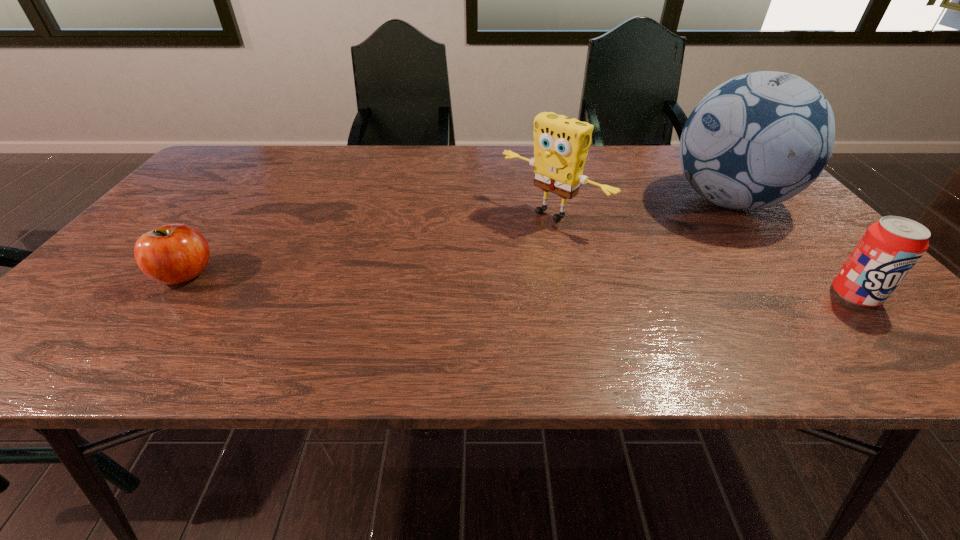
Image resolution: width=960 pixels, height=540 pixels. I want to click on object that is positioned at the far right corner, so click(x=758, y=139).

Where is `object at the near right corner`? This screenshot has width=960, height=540. object at the near right corner is located at coordinates (889, 249).

You are a GUI agent. You are given a task and a screenshot of the screen. Output one action in this format:
    pyautogui.click(x=<x>, y=<y>)
    Task: Click on the free spot at the far edge of the desktop
    
    Given the screenshot: What is the action you would take?
    pyautogui.click(x=355, y=171)

Find the location of a particular element. The image size is (960, 540). blank space at the near edge of the desktop is located at coordinates (333, 300).

Locate an element on the screen. The height and width of the screenshot is (540, 960). vacant space at the right edge is located at coordinates (800, 260).

Where is `vacant region at the far left corner of the desktop`? vacant region at the far left corner of the desktop is located at coordinates (229, 147).

Where is `vacant space at the near right corner of the desktop`? The image size is (960, 540). vacant space at the near right corner of the desktop is located at coordinates (821, 296).

You are a GUI agent. You are given a task and a screenshot of the screen. Output one action in this format:
    pyautogui.click(x=<x>, y=<y>)
    Task: Click on the vacant space that is in between the soccer ball and the third shortest object
    The width and height of the screenshot is (960, 540).
    Given the screenshot: What is the action you would take?
    pyautogui.click(x=640, y=207)

I want to click on unoccupied area between the sponge and the second shortest object, so click(x=704, y=254).

This screenshot has width=960, height=540. Identify the location of free space between the soccer ball and the sponge. (640, 207).